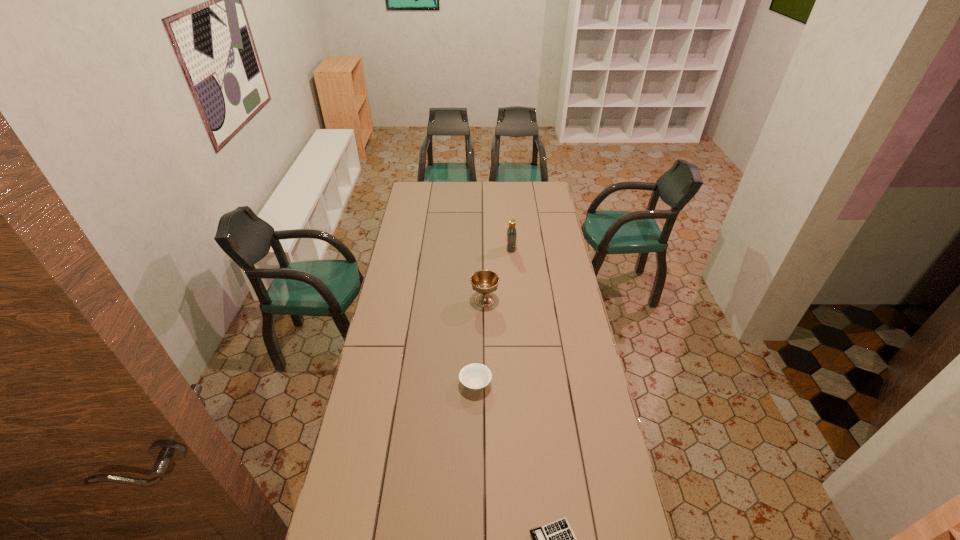
Where is `the tallest object`? The image size is (960, 540). the tallest object is located at coordinates tap(511, 231).

This screenshot has height=540, width=960. In order to click on vodka in this screenshot , I will do `click(511, 231)`.

Image resolution: width=960 pixels, height=540 pixels. I want to click on chalice, so 484,282.

Where is `the third shortest object`? This screenshot has width=960, height=540. the third shortest object is located at coordinates (484, 282).

At what (x,y) coordinates should I click in order to perform the action: click on the second shortest object. Please return your answer as a coordinate pair (x, y). Looking at the image, I should click on (475, 376).

This screenshot has height=540, width=960. I want to click on bowl, so click(475, 376).

Identify the location of vacant space located on the front-facing side of the tallest object. (480, 248).

The height and width of the screenshot is (540, 960). I want to click on vacant area situated on the front-facing side of the tallest object, so click(471, 248).

Locate an element on the screen. Image resolution: width=960 pixels, height=540 pixels. vacant space positioned 0.170m on the front-facing side of the tallest object is located at coordinates (475, 248).

Find the location of a particular element. This screenshot has width=960, height=540. vacant space located on the left of the third nearest object is located at coordinates (445, 300).